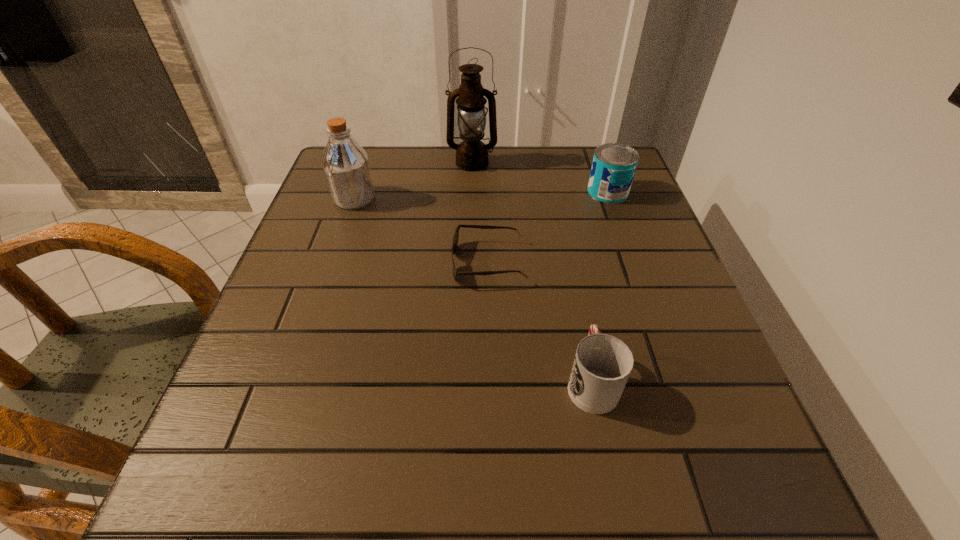
You are a GUI agent. You are given a task and a screenshot of the screen. Output one action in this format:
    pyautogui.click(x=<x>, y=<y>)
    Task: Click on the can at the far edge
    The height and width of the screenshot is (540, 960).
    Given the screenshot: What is the action you would take?
    pyautogui.click(x=614, y=164)

Where is `object present at the left edge`? The image size is (960, 540). object present at the left edge is located at coordinates pyautogui.click(x=346, y=166).

At what (x,y) coordinates should I click in order to perform the action: click on object at the right edge. Please return your answer as a coordinate pair (x, y). Looking at the image, I should click on (614, 164).

At what (x,y) coordinates should I click in order to perform the action: click on object located at the far left corner. Please return your answer as a coordinate pair (x, y). Looking at the image, I should click on (346, 166).

The width and height of the screenshot is (960, 540). I want to click on object at the far right corner, so click(x=614, y=164).

At what (x,y) coordinates should I click in order to perform the action: click on free space at the far edge of the desktop. Please return your answer as a coordinate pair (x, y). This screenshot has height=540, width=960. Looking at the image, I should click on (570, 185).

This screenshot has height=540, width=960. I want to click on vacant space at the left edge of the desktop, so click(318, 206).

In the image, there is a desktop. Where is `vacant area at the right edge`? vacant area at the right edge is located at coordinates [620, 221].

Locate an element on the screen. free area in between the tallest object and the leftmost object is located at coordinates (413, 181).

Identify the location of empty location between the shortest object and the can. Image resolution: width=960 pixels, height=540 pixels. (548, 227).